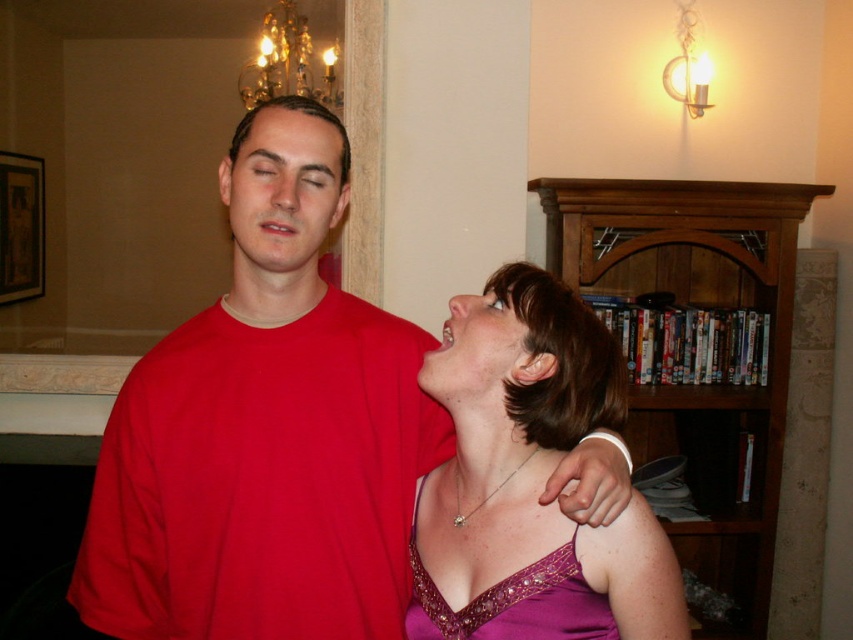
Question: Which object is farther from the camera taking this photo?

Choices:
 (A) purple satin dress at center
 (B) gold crystal chandelier at upper center
 (C) wooden bookshelf at right
 (D) matte red shirt at center

Answer: (C)

Question: Does wooden bookshelf at right appear over purple satin dress at lower right?

Choices:
 (A) yes
 (B) no

Answer: (B)

Question: Is wooden bookshelf at right wider than purple satin dress at lower right?

Choices:
 (A) no
 (B) yes

Answer: (B)

Question: Can you confirm if purple satin dress at lower right is positioned to the right of matte purple dress at lower right?

Choices:
 (A) no
 (B) yes

Answer: (B)

Question: Which point is farther to the camera?

Choices:
 (A) matte red t-shirt at center
 (B) purple satin dress at lower right
 (C) matte red shirt at center

Answer: (C)

Question: Estimate the real-world distances between objects in this image. Which object is closer to the purple satin dress at center?

Choices:
 (A) matte red t-shirt at center
 (B) matte purple dress at lower right
 (C) gold crystal chandelier at upper center
 (D) wooden bookshelf at right

Answer: (A)